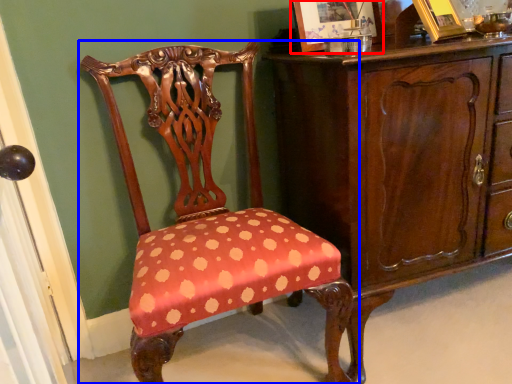
Question: Which of the following is the closest to the observer, picture frame (highlighted by a red box) or chair (highlighted by a blue box)?

Choices:
 (A) picture frame
 (B) chair

Answer: (B)